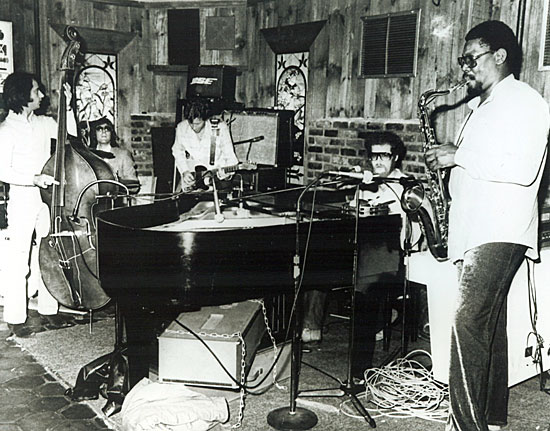
This screenshot has width=550, height=431. What are the coordinates of `piano` in the screenshot? It's located at (241, 260).